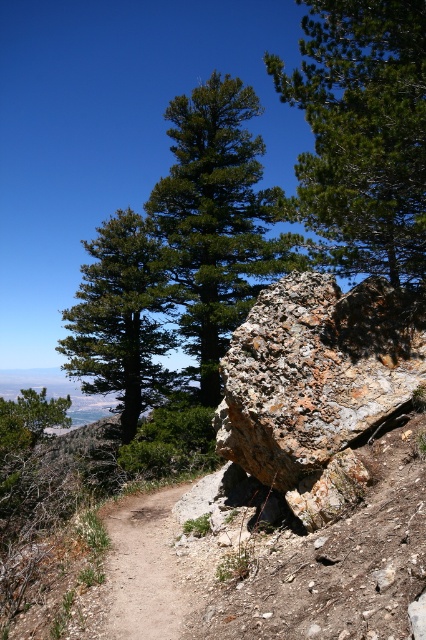
Which is more to the right, green leafy tree at center or brown dirt track at center?

green leafy tree at center is more to the right.

Between green leafy tree at center and brown dirt track at center, which one has less height?

brown dirt track at center

The height and width of the screenshot is (640, 426). Identify the location of green leafy tree at center. (218, 220).

Which of these two, green matte tree at upper center or green matte tree at upper left, stands shorter?

Standing shorter between the two is green matte tree at upper left.

Is green matte tree at upper center smaller than green matte tree at upper left?

Correct, green matte tree at upper center occupies less space than green matte tree at upper left.

Find the location of `green matte tree at upper center`. green matte tree at upper center is located at coordinates (362, 134).

Who is more distant from viewer, (138, 605) or (32, 424)?

Point (32, 424)

Between brown dirt track at center and green matte tree at upper left, which one appears on the left side from the viewer's perspective?

From the viewer's perspective, green matte tree at upper left appears more on the left side.

The width and height of the screenshot is (426, 640). In order to click on brown dirt track at center in this screenshot , I will do `click(141, 568)`.